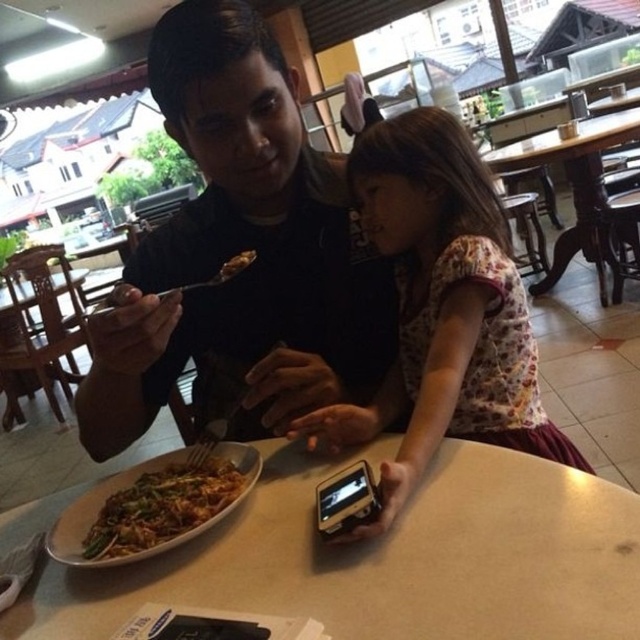
What is the color of the fabric at the point with coordinates (442, 308)?

The fabric at the point with coordinates (442, 308) is floral patterned.

You are a server at a restaurant and need to place a new dish on the wooden table at center. The dish is as wide as the brown matte food at upper center. Will the dish fit on the table without overhanging the edges?

The wooden table at center is wider than the brown matte food at upper center, so the dish will fit without overhanging the edges.

Consider the image. You are at the point labeled point (317, 209) and want to move to the point labeled point (525, 392). Which direction should you move to get closer to your destination?

To move from point (317, 209) to point (525, 392), you should move forward since point (317, 209) is behind point (525, 392), meaning it is in the rear position relative to the viewer. Moving forward would bring you closer to the destination.